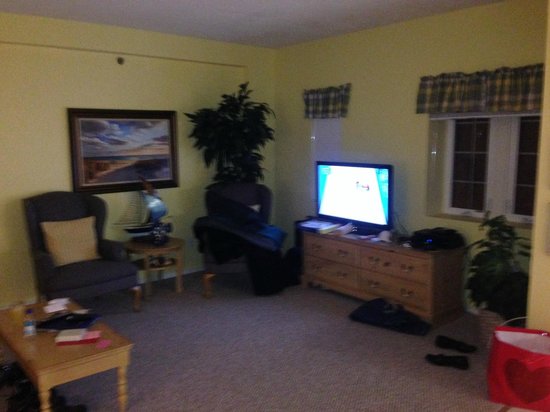
This screenshot has height=412, width=550. In order to click on book in this screenshot , I will do `click(309, 223)`.